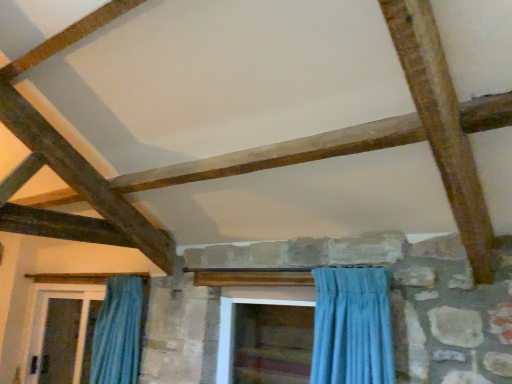
Question: In terms of width, does wooden screen door at center, the 1th screen door when ordered from right to left, look wider or thinner when compared to blue fabric curtain at left?

Choices:
 (A) wide
 (B) thin

Answer: (A)

Question: From the image's perspective, is wooden screen door at center, marked as the 2th screen door in a left-to-right arrangement, located above or below blue fabric curtain at left?

Choices:
 (A) below
 (B) above

Answer: (B)

Question: Which is farther from the blue fabric curtain at left?

Choices:
 (A) clear glass screen door at lower left, arranged as the second screen door when viewed from the front
 (B) wooden screen door at center, marked as the 2th screen door in a left-to-right arrangement

Answer: (A)

Question: Considering the real-world distances, which object is farthest from the clear glass screen door at lower left, which ranks as the 1th screen door in left-to-right order?

Choices:
 (A) blue fabric curtain at left
 (B) wooden screen door at center, marked as the first screen door in a front-to-back arrangement

Answer: (B)